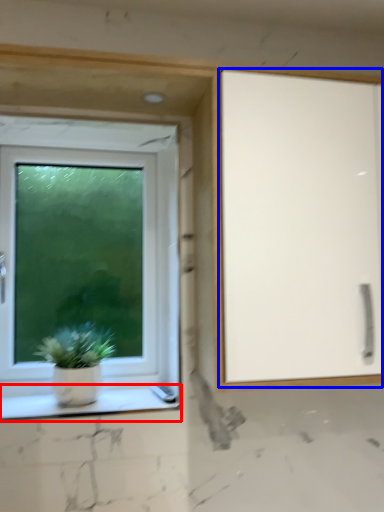
Question: Which of the following is the farthest to the observer, window sill (highlighted by a red box) or screen door (highlighted by a blue box)?

Choices:
 (A) window sill
 (B) screen door

Answer: (A)